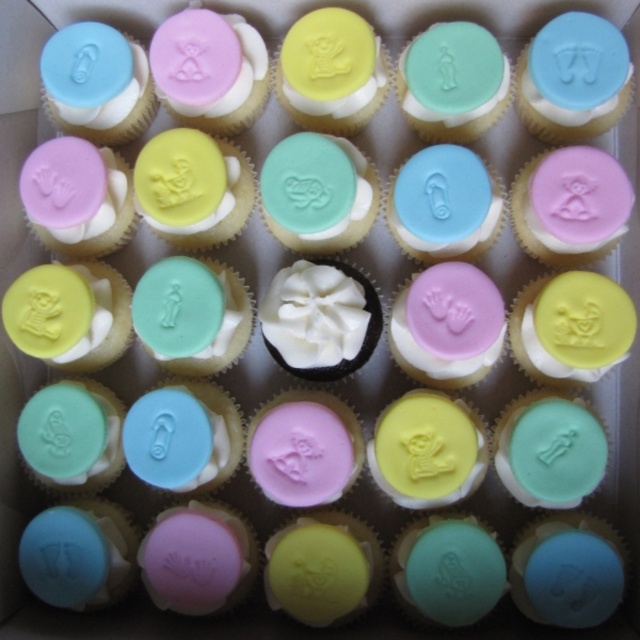
Question: Among these points, which one is farthest from the camera?

Choices:
 (A) (572, 42)
 (B) (369, 317)

Answer: (A)

Question: Is blue matte flip-flop at upper right behind white fluffy frosting at center?

Choices:
 (A) no
 (B) yes

Answer: (B)

Question: Is blue matte flip-flop at upper right to the right of white fluffy frosting at center from the viewer's perspective?

Choices:
 (A) no
 (B) yes

Answer: (B)

Question: Is blue matte flip-flop at upper right thinner than white fluffy frosting at center?

Choices:
 (A) yes
 (B) no

Answer: (B)